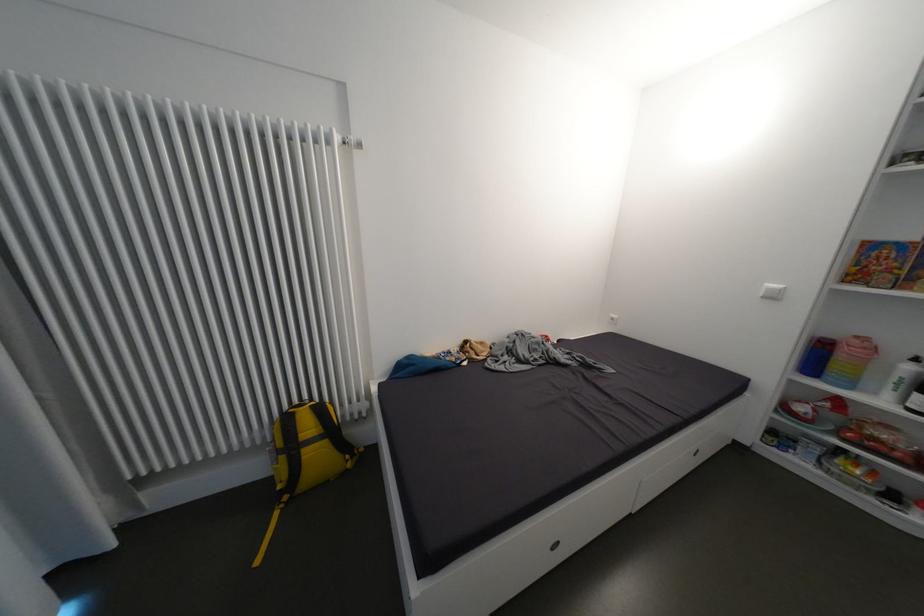
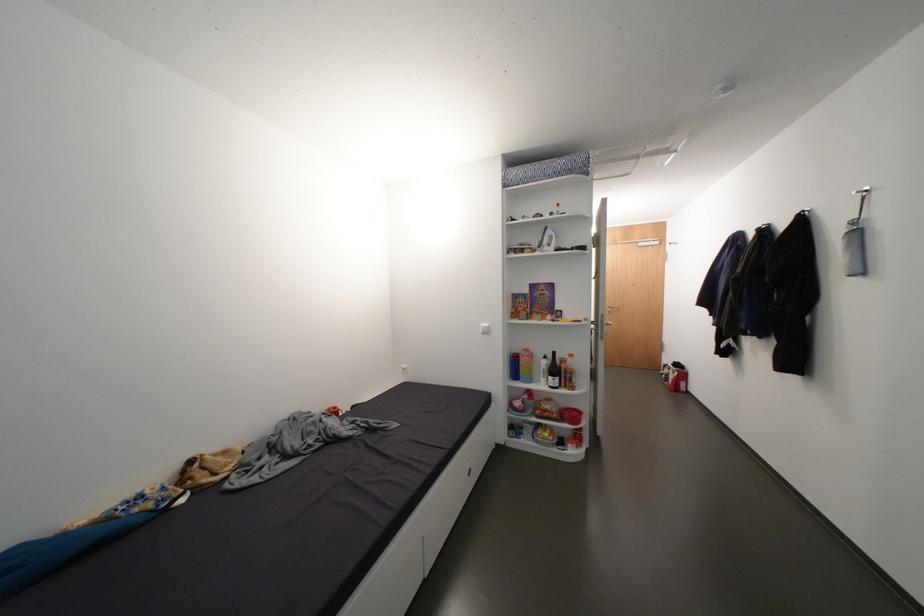
Question: How did the camera likely rotate?

Choices:
 (A) Left
 (B) Right
 (C) Up
 (D) Down

Answer: (B)